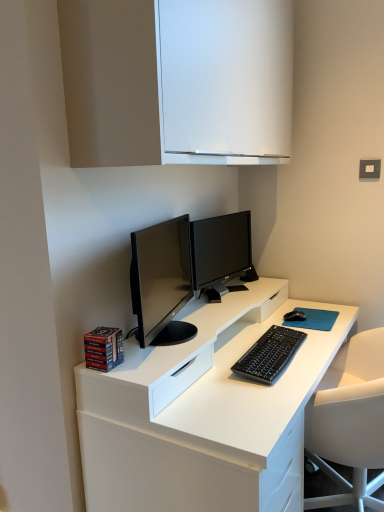
Question: Is the surface of black matte mouse at right in direct contact with satin black monitor at center?

Choices:
 (A) yes
 (B) no

Answer: (B)

Question: Is black matte mouse at right positioned far away from satin black monitor at center?

Choices:
 (A) yes
 (B) no

Answer: (B)

Question: Is black matte mouse at right oriented towards satin black monitor at center?

Choices:
 (A) yes
 (B) no

Answer: (B)

Question: Is black matte mouse at right at the right side of satin black monitor at center?

Choices:
 (A) no
 (B) yes

Answer: (B)

Question: Is satin black monitor at center surrounded by black matte mouse at right?

Choices:
 (A) yes
 (B) no

Answer: (B)

Question: Considering the positions of black matte mouse at right and black matte keyboard at center in the image, is black matte mouse at right wider or thinner than black matte keyboard at center?

Choices:
 (A) wide
 (B) thin

Answer: (B)

Question: In the image, is black matte mouse at right on the left side or the right side of black matte keyboard at center?

Choices:
 (A) right
 (B) left

Answer: (A)

Question: From a real-world perspective, relative to black matte keyboard at center, is black matte mouse at right vertically above or below?

Choices:
 (A) above
 (B) below

Answer: (A)

Question: Relative to black matte keyboard at center, is black matte mouse at right in front or behind?

Choices:
 (A) front
 (B) behind

Answer: (B)

Question: Looking at their shapes, would you say white glossy desk at center is wider or thinner than black matte keyboard at center?

Choices:
 (A) thin
 (B) wide

Answer: (B)

Question: Based on their positions, is white glossy desk at center located to the left or right of black matte keyboard at center?

Choices:
 (A) left
 (B) right

Answer: (A)

Question: In the image, is white glossy desk at center positioned in front of or behind black matte keyboard at center?

Choices:
 (A) behind
 (B) front

Answer: (B)

Question: From a real-world perspective, is white glossy desk at center positioned above or below black matte keyboard at center?

Choices:
 (A) below
 (B) above

Answer: (A)

Question: In terms of height, does white matte cabinet at upper center look taller or shorter compared to black matte keyboard at center?

Choices:
 (A) tall
 (B) short

Answer: (A)

Question: Is white matte cabinet at upper center wider or thinner than black matte keyboard at center?

Choices:
 (A) thin
 (B) wide

Answer: (B)